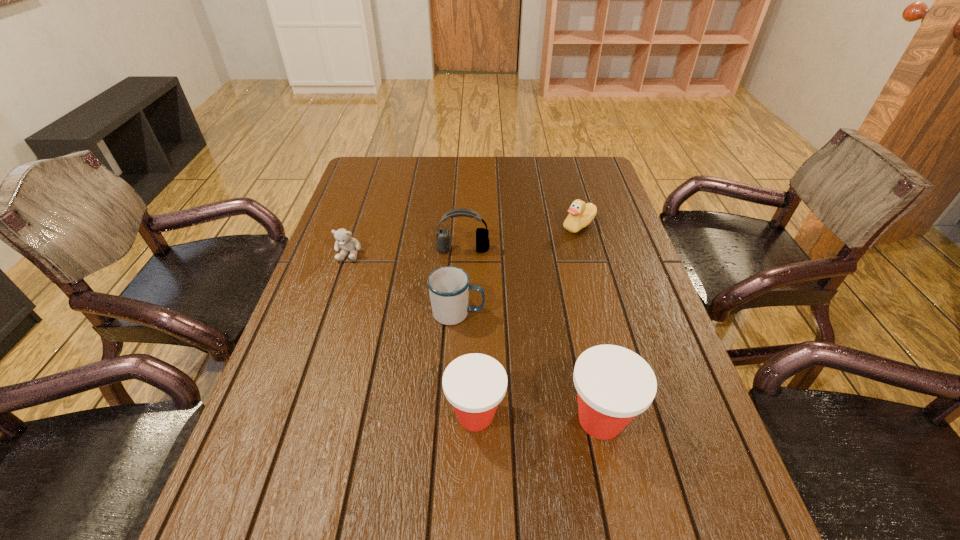
Locate an element on the screen. vacant area situated 0.090m at the beak of the farthest object is located at coordinates click(x=533, y=226).

The height and width of the screenshot is (540, 960). What are the coordinates of `free space located on the headband of the headset` in the screenshot? It's located at (461, 305).

The height and width of the screenshot is (540, 960). What are the coordinates of `free space located on the face of the leftmost object` in the screenshot? It's located at (320, 339).

What are the coordinates of `vacant area located 0.190m on the handle side of the mug` in the screenshot? It's located at (561, 313).

Where is `object that is at the near edge`? This screenshot has height=540, width=960. object that is at the near edge is located at coordinates (614, 384).

This screenshot has height=540, width=960. I want to click on object that is at the left edge, so click(343, 237).

Where is `Dixie cup located at the right edge`? The image size is (960, 540). Dixie cup located at the right edge is located at coordinates (614, 384).

Locate an element on the screen. duck present at the right edge is located at coordinates (580, 215).

I want to click on object present at the near right corner, so click(x=614, y=384).

Where is `vacant space at the far edge of the desktop`? The height and width of the screenshot is (540, 960). vacant space at the far edge of the desktop is located at coordinates (478, 174).